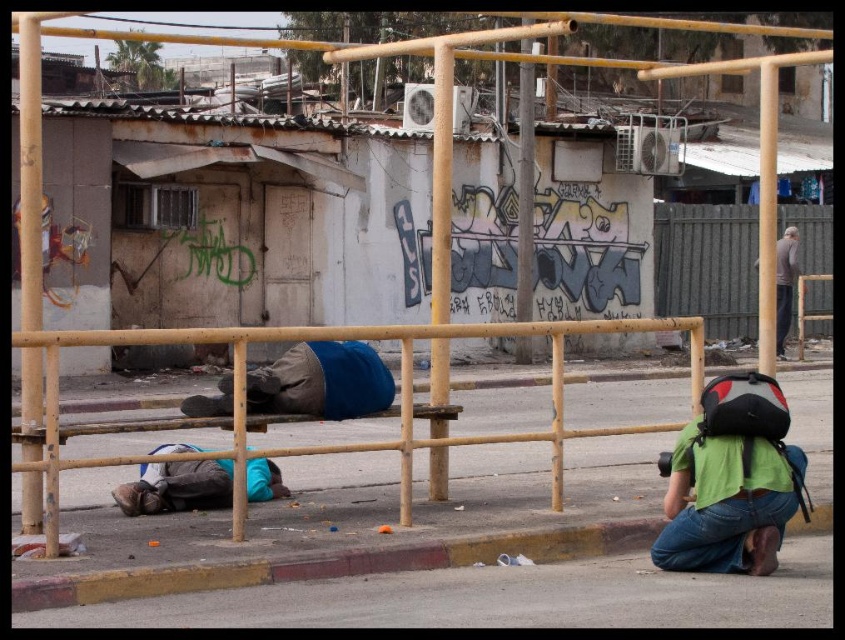
Question: Which is farther from the gray wooden fence at right?

Choices:
 (A) wooden railing at center
 (B) green fabric backpack at lower right

Answer: (B)

Question: Estimate the real-world distances between objects in this image. Which object is farther from the concrete curb at lower center?

Choices:
 (A) gray wooden fence at right
 (B) blue fabric at center
 (C) wooden railing at center

Answer: (A)

Question: Is green fabric backpack at lower right thinner than blue fabric blanket at lower center?

Choices:
 (A) no
 (B) yes

Answer: (B)

Question: Is blue fabric at center wider than gray fabric pants at right?

Choices:
 (A) no
 (B) yes

Answer: (A)

Question: Which point is closer to the camera?

Choices:
 (A) (791, 310)
 (B) (368, 445)
 (C) (691, 244)

Answer: (B)

Question: Does gray wooden fence at right have a larger size compared to blue fabric at center?

Choices:
 (A) no
 (B) yes

Answer: (B)